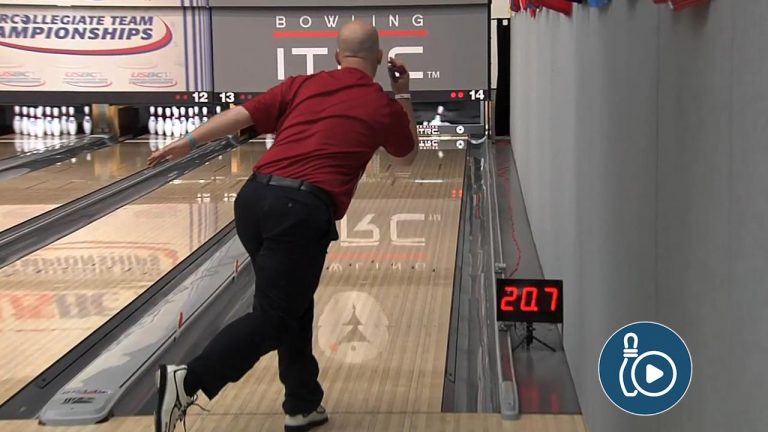
Locate an element on the screen. The image size is (768, 432). timer is located at coordinates (533, 306).